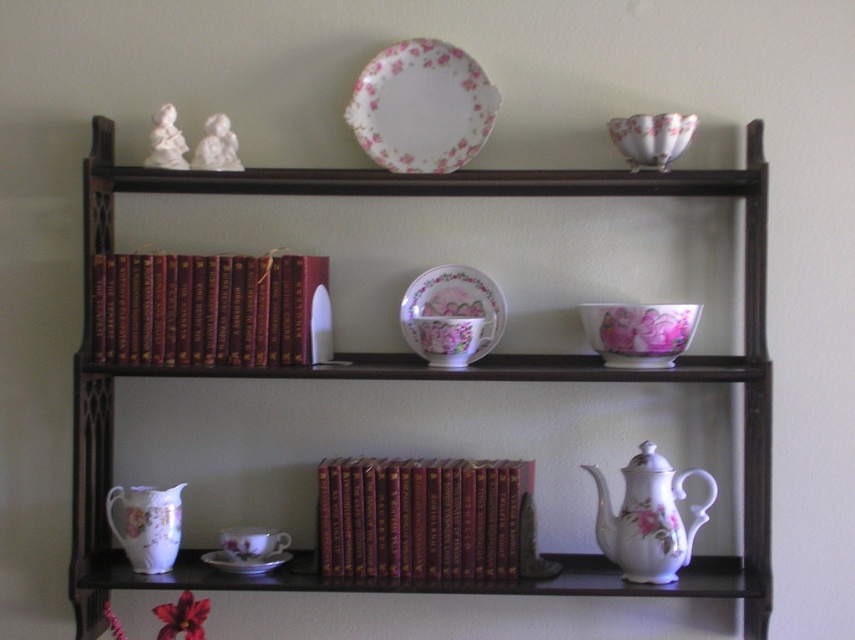
Can you confirm if matte dark wood bookshelf at center is positioned to the right of maroon leather book at center?

No, matte dark wood bookshelf at center is not to the right of maroon leather book at center.

Between point (293, 173) and point (469, 497), which one is positioned in front?

Positioned in front is point (293, 173).

Between point (281, 173) and point (337, 483), which one is positioned behind?

Point (337, 483)

Find the location of a particular element. matte dark wood bookshelf at center is located at coordinates (422, 360).

Who is positioned more to the right, maroon leather book at center or white porcelain saucer at lower center?

maroon leather book at center

Is maroon leather book at center positioned in front of white porcelain saucer at lower center?

Yes, maroon leather book at center is closer to the viewer.

The image size is (855, 640). What are the coordinates of `maroon leather book at center` in the screenshot? It's located at (425, 518).

Which is below, maroon leather book at left or white porcelain saucer at lower center?

white porcelain saucer at lower center

Describe the element at coordinates (210, 308) in the screenshot. Image resolution: width=855 pixels, height=640 pixels. I see `maroon leather book at left` at that location.

Where is `maroon leather book at left`? Image resolution: width=855 pixels, height=640 pixels. maroon leather book at left is located at coordinates (210, 308).